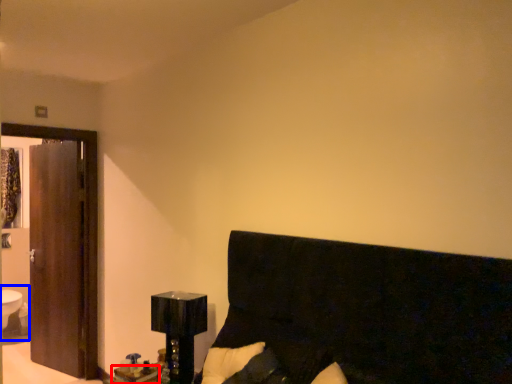
Question: Among these objects, which one is farthest to the camera, table (highlighted by a red box) or sink (highlighted by a blue box)?

Choices:
 (A) table
 (B) sink

Answer: (B)